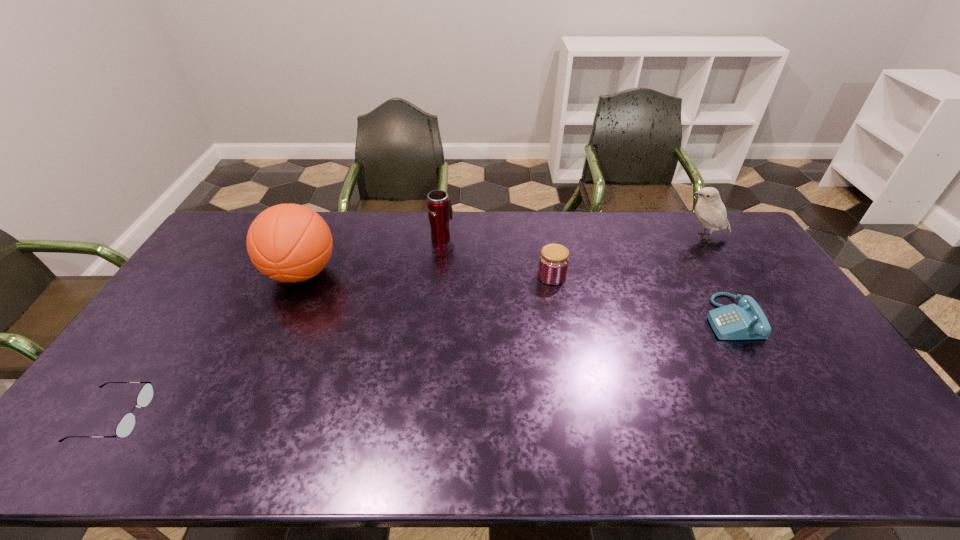
Locate an element on the screen. free space located 0.250m at the beak of the bird is located at coordinates (611, 237).

Where is `free space located 0.190m at the beak of the bird`? The height and width of the screenshot is (540, 960). free space located 0.190m at the beak of the bird is located at coordinates click(x=627, y=237).

Where is `free location located at the beak of the bird`? The image size is (960, 540). free location located at the beak of the bird is located at coordinates point(619,237).

The image size is (960, 540). Identify the location of free location located 0.110m on the side with the handle of the thermos bottle. (444, 213).

At what (x,y) coordinates should I click in order to perform the action: click on free space located on the side with the handle of the thermos bottle. Please return your answer as a coordinate pair (x, y). The width and height of the screenshot is (960, 540). Looking at the image, I should click on (444, 212).

The width and height of the screenshot is (960, 540). I want to click on free space located on the left of the fourth object from left to right, so click(507, 276).

This screenshot has width=960, height=540. In order to click on vacant space located on the dial of the telephone in this screenshot , I will do `click(627, 319)`.

The height and width of the screenshot is (540, 960). In order to click on blank area located 0.250m on the dial of the telephone in this screenshot , I will do `click(623, 319)`.

Where is `vacant region located 0.390m on the dial of the telephone`? The height and width of the screenshot is (540, 960). vacant region located 0.390m on the dial of the telephone is located at coordinates (577, 319).

In order to click on vacant space located on the lenses of the shortest object in this screenshot , I will do pyautogui.click(x=256, y=416).